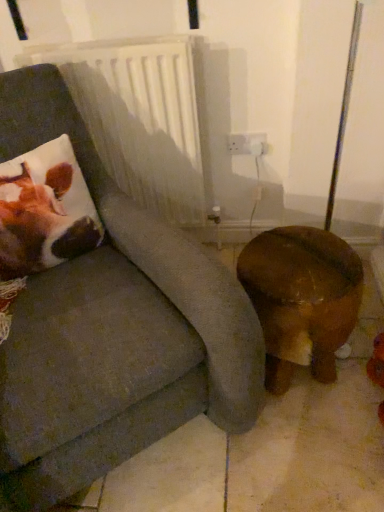
Question: Considering the relative positions of brown plush cushion at left and white plastic radiator at upper center in the image provided, is brown plush cushion at left to the left of white plastic radiator at upper center from the viewer's perspective?

Choices:
 (A) no
 (B) yes

Answer: (B)

Question: Is brown plush cushion at left taller than white plastic radiator at upper center?

Choices:
 (A) yes
 (B) no

Answer: (B)

Question: Can you confirm if brown plush cushion at left is shorter than white plastic radiator at upper center?

Choices:
 (A) no
 (B) yes

Answer: (B)

Question: From the image's perspective, would you say brown plush cushion at left is shown under white plastic radiator at upper center?

Choices:
 (A) no
 (B) yes

Answer: (B)

Question: Does brown plush cushion at left have a larger size compared to white plastic radiator at upper center?

Choices:
 (A) no
 (B) yes

Answer: (A)

Question: Would you say brown wooden stool at lower right is inside or outside white plastic radiator at upper center?

Choices:
 (A) outside
 (B) inside

Answer: (A)

Question: Is brown wooden stool at lower right taller or shorter than white plastic radiator at upper center?

Choices:
 (A) short
 (B) tall

Answer: (A)

Question: In the image, is brown wooden stool at lower right on the left side or the right side of white plastic radiator at upper center?

Choices:
 (A) left
 (B) right

Answer: (B)

Question: From a real-world perspective, is brown wooden stool at lower right positioned above or below white plastic radiator at upper center?

Choices:
 (A) below
 (B) above

Answer: (A)

Question: Is white plastic radiator at upper center in front of or behind brown wooden stool at lower right in the image?

Choices:
 (A) behind
 (B) front

Answer: (A)

Question: Is white plastic radiator at upper center wider or thinner than brown wooden stool at lower right?

Choices:
 (A) wide
 (B) thin

Answer: (B)

Question: From a real-world perspective, relative to brown wooden stool at lower right, is white plastic radiator at upper center vertically above or below?

Choices:
 (A) below
 (B) above

Answer: (B)

Question: Is white plastic radiator at upper center situated inside brown wooden stool at lower right or outside?

Choices:
 (A) outside
 (B) inside

Answer: (A)

Question: Is brown plush cushion at left inside the boundaries of suede-like gray chair at left, or outside?

Choices:
 (A) inside
 (B) outside

Answer: (A)

Question: Considering the positions of brown plush cushion at left and suede-like gray chair at left in the image, is brown plush cushion at left bigger or smaller than suede-like gray chair at left?

Choices:
 (A) small
 (B) big

Answer: (A)